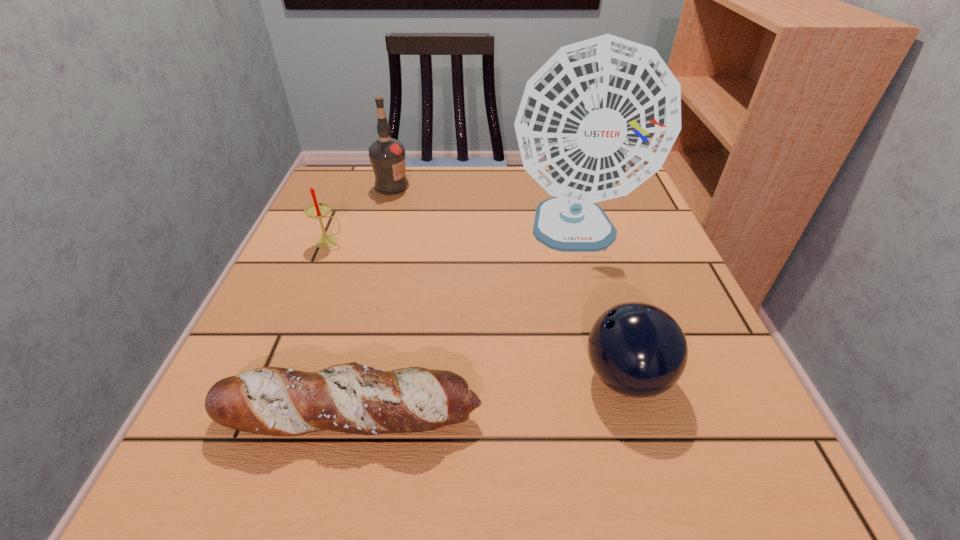
Find the location of a particular element. empty space between the baguet and the bowling ball is located at coordinates (489, 396).

What are the coordinates of `object identified as the closest to the fourth shortest object` in the screenshot? It's located at (317, 210).

Identify which object is located as the fourth nearest to the fourth shortest object. Please provide its 2D coordinates. Your answer should be formatted as a tuple, i.e. [(x, y)], where the tuple contains the x and y coordinates of a point satisfying the conditions above.

[(637, 349)]

Where is `free location that satisfies the following two spatial constraints: 1. on the surface of the bowling ball near the finger holes; 2. on the front side of the baguet`? free location that satisfies the following two spatial constraints: 1. on the surface of the bowling ball near the finger holes; 2. on the front side of the baguet is located at coordinates (636, 414).

Where is `vacant space that satisfies the following two spatial constraints: 1. on the front label of the shortest object; 2. on the right side of the farthest object`? This screenshot has width=960, height=540. vacant space that satisfies the following two spatial constraints: 1. on the front label of the shortest object; 2. on the right side of the farthest object is located at coordinates (326, 414).

The height and width of the screenshot is (540, 960). Find the location of `free space that satisfies the following two spatial constraints: 1. on the front label of the second tallest object; 2. on the back side of the baguet`. free space that satisfies the following two spatial constraints: 1. on the front label of the second tallest object; 2. on the back side of the baguet is located at coordinates (326, 414).

Identify the location of blank space that satisfies the following two spatial constraints: 1. on the front label of the shortest object; 2. on the right side of the vodka. The height and width of the screenshot is (540, 960). (326, 414).